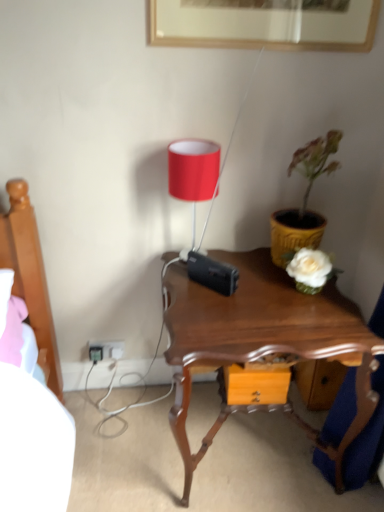
Question: From a real-world perspective, is black plastic plug at lower left on top of mahogany wood nightstand at center?

Choices:
 (A) no
 (B) yes

Answer: (A)

Question: Is black plastic plug at lower left turned away from mahogany wood nightstand at center?

Choices:
 (A) no
 (B) yes

Answer: (A)

Question: Considering the relative sizes of black plastic plug at lower left and mahogany wood nightstand at center in the image provided, is black plastic plug at lower left shorter than mahogany wood nightstand at center?

Choices:
 (A) yes
 (B) no

Answer: (A)

Question: From a real-world perspective, is black plastic plug at lower left below mahogany wood nightstand at center?

Choices:
 (A) yes
 (B) no

Answer: (A)

Question: Can you confirm if black plastic plug at lower left is thinner than mahogany wood nightstand at center?

Choices:
 (A) yes
 (B) no

Answer: (A)

Question: Considering the positions of yellow textured pot at right and mahogany wood nightstand at center in the image, is yellow textured pot at right bigger or smaller than mahogany wood nightstand at center?

Choices:
 (A) big
 (B) small

Answer: (B)

Question: From the image's perspective, relative to mahogany wood nightstand at center, is yellow textured pot at right above or below?

Choices:
 (A) above
 (B) below

Answer: (A)

Question: In terms of width, does yellow textured pot at right look wider or thinner when compared to mahogany wood nightstand at center?

Choices:
 (A) thin
 (B) wide

Answer: (A)

Question: Is yellow textured pot at right to the left or to the right of mahogany wood nightstand at center in the image?

Choices:
 (A) left
 (B) right

Answer: (B)

Question: From a real-world perspective, is mahogany wood nightstand at center above or below white plastic electric outlet at lower left?

Choices:
 (A) above
 (B) below

Answer: (A)

Question: Is mahogany wood nightstand at center taller or shorter than white plastic electric outlet at lower left?

Choices:
 (A) short
 (B) tall

Answer: (B)

Question: From the image's perspective, relative to white plastic electric outlet at lower left, is mahogany wood nightstand at center above or below?

Choices:
 (A) above
 (B) below

Answer: (B)

Question: Is mahogany wood nightstand at center situated inside white plastic electric outlet at lower left or outside?

Choices:
 (A) inside
 (B) outside

Answer: (B)

Question: Which is correct: black plastic plug at lower left is inside matte red lampshade at upper center, or outside of it?

Choices:
 (A) inside
 (B) outside

Answer: (B)

Question: Is black plastic plug at lower left wider or thinner than matte red lampshade at upper center?

Choices:
 (A) wide
 (B) thin

Answer: (B)